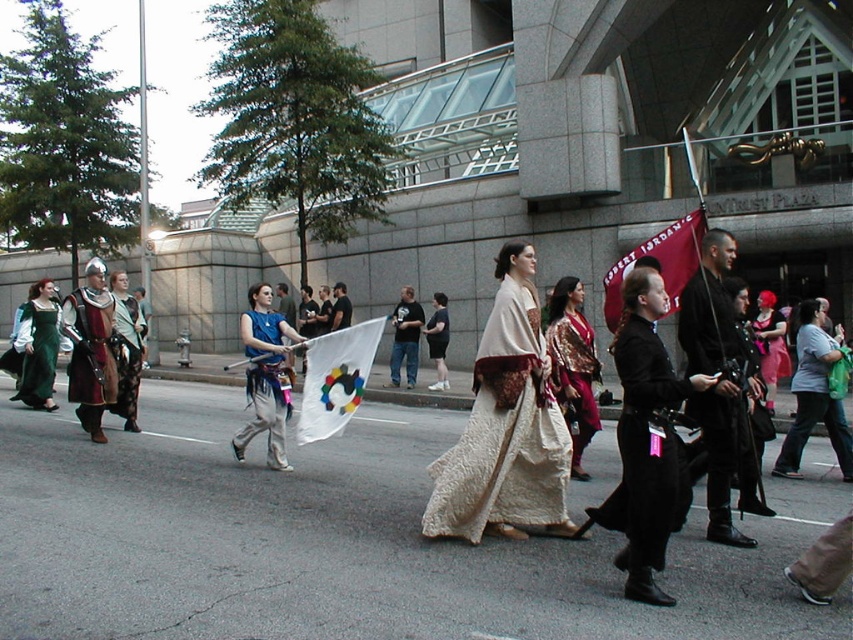
Question: Can you confirm if silky gold kimono at center is smaller than white cotton dress at center?

Choices:
 (A) no
 (B) yes

Answer: (A)

Question: Estimate the real-world distances between objects in this image. Which object is farther from the black leather armor at center?

Choices:
 (A) silky gold kimono at center
 (B) white textured kimono at center
 (C) shiny pink fabric at center

Answer: (C)

Question: Which object is closer to the camera taking this photo?

Choices:
 (A) red fabric flag at center
 (B) shiny pink fabric at center
 (C) black leather armor at center
 (D) blue fabric vest at center

Answer: (C)

Question: Is white textured kimono at center thinner than black leather armor at center?

Choices:
 (A) no
 (B) yes

Answer: (A)

Question: Does black velvet cape at center have a greater width compared to red fabric flag at center?

Choices:
 (A) no
 (B) yes

Answer: (B)

Question: Which object is the farthest from the red fabric flag at center?

Choices:
 (A) green fabric bag at lower right
 (B) white textured kimono at center
 (C) matte brown leather armor at left
 (D) black velvet cape at center

Answer: (C)